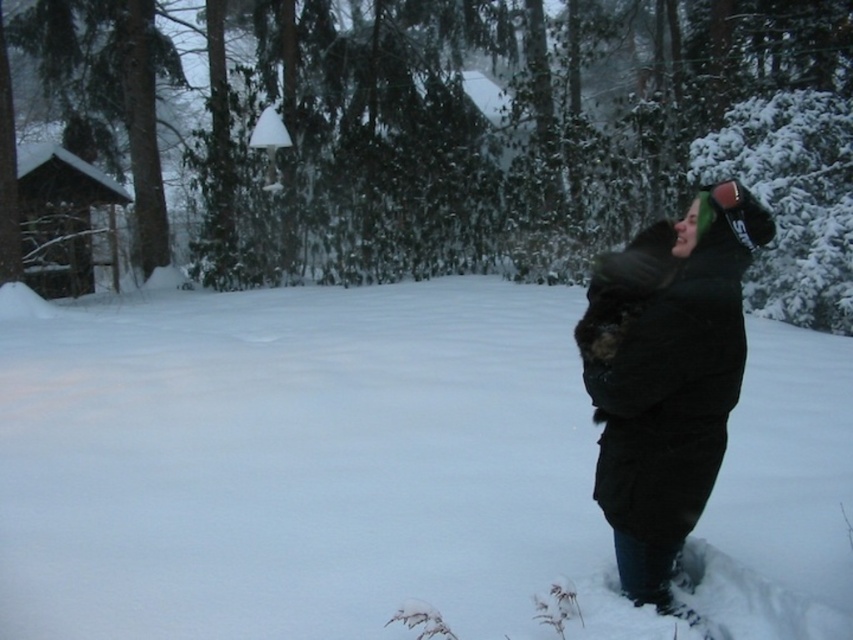
Question: Among these points, which one is nearest to the camera?

Choices:
 (A) (294, 477)
 (B) (706, 392)

Answer: (B)

Question: Is white fluffy snow at center smaller than black fuzzy coat at right?

Choices:
 (A) no
 (B) yes

Answer: (A)

Question: Does white fluffy snow at center have a smaller size compared to black fuzzy coat at right?

Choices:
 (A) no
 (B) yes

Answer: (A)

Question: Which point is closer to the camera?

Choices:
 (A) black fuzzy coat at right
 (B) white fluffy snow at center

Answer: (A)

Question: Which point is farther to the camera?

Choices:
 (A) (610, 305)
 (B) (469, 636)

Answer: (B)

Question: Is white fluffy snow at center positioned before black fuzzy coat at right?

Choices:
 (A) yes
 (B) no

Answer: (B)